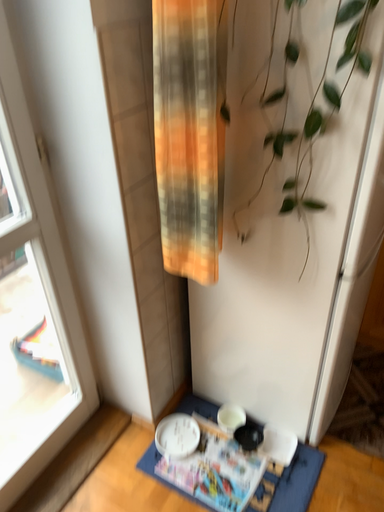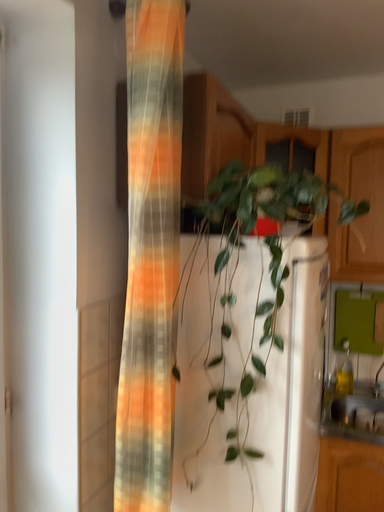
Question: How did the camera likely rotate when shooting the video?

Choices:
 (A) rotated downward
 (B) rotated upward

Answer: (B)